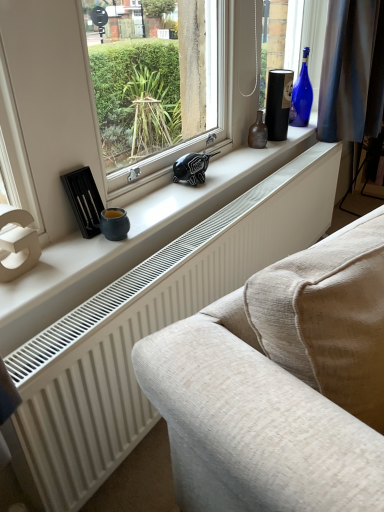
This screenshot has width=384, height=512. What are the coordinates of `blank space situated above white matte window sill at center (from a real-world perspective)` in the screenshot? It's located at (193, 186).